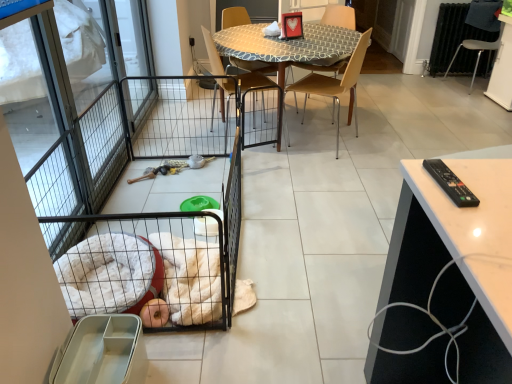
Question: Considering the relative positions of wooden chair at center, the second chair viewed from the right, and black wire pet cage at left in the image provided, is wooden chair at center, the second chair viewed from the right, to the left or to the right of black wire pet cage at left?

Choices:
 (A) right
 (B) left

Answer: (A)

Question: Is wooden chair at center, which is counted as the 3th chair, starting from the left, in front of or behind black wire pet cage at left in the image?

Choices:
 (A) behind
 (B) front

Answer: (A)

Question: Which of these objects is positioned closest to the light brown plastic chair at center, the 3th chair when ordered from right to left?

Choices:
 (A) black wire pet cage at left
 (B) wooden chair at center, the second chair viewed from the right
 (C) metallic silver chair at right, positioned as the 4th chair in left-to-right order
 (D) metallic screen door at left
 (E) wooden chair at center, which is the fourth chair in right-to-left order

Answer: (E)

Question: Estimate the real-world distances between objects in this image. Which object is closer to the metallic silver chair at right, positioned as the 4th chair in left-to-right order?

Choices:
 (A) metallic screen door at left
 (B) patterned fabric table at center
 (C) light brown plastic chair at center, the 3th chair when ordered from right to left
 (D) wooden chair at center, positioned as the first chair in left-to-right order
 (E) white glossy table at right

Answer: (C)